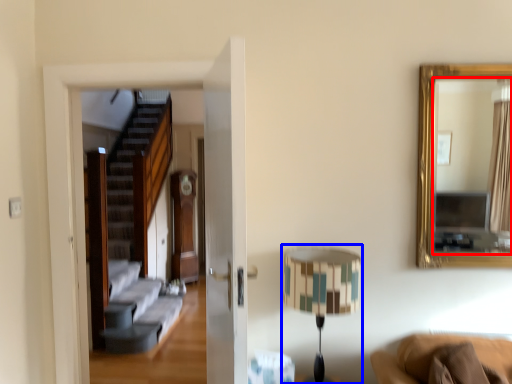
Question: Among these objects, which one is farthest to the camera, mirror (highlighted by a red box) or table lamp (highlighted by a blue box)?

Choices:
 (A) mirror
 (B) table lamp

Answer: (A)